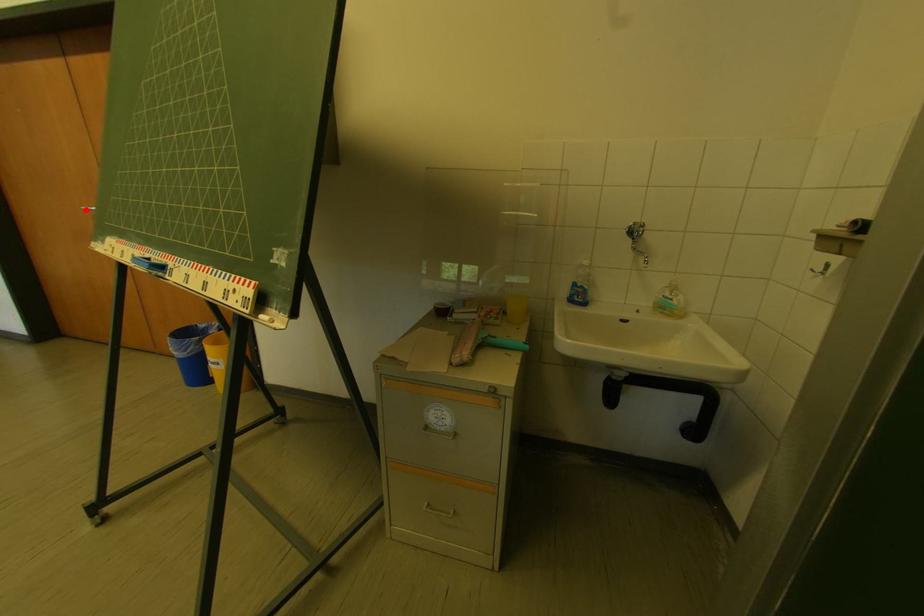
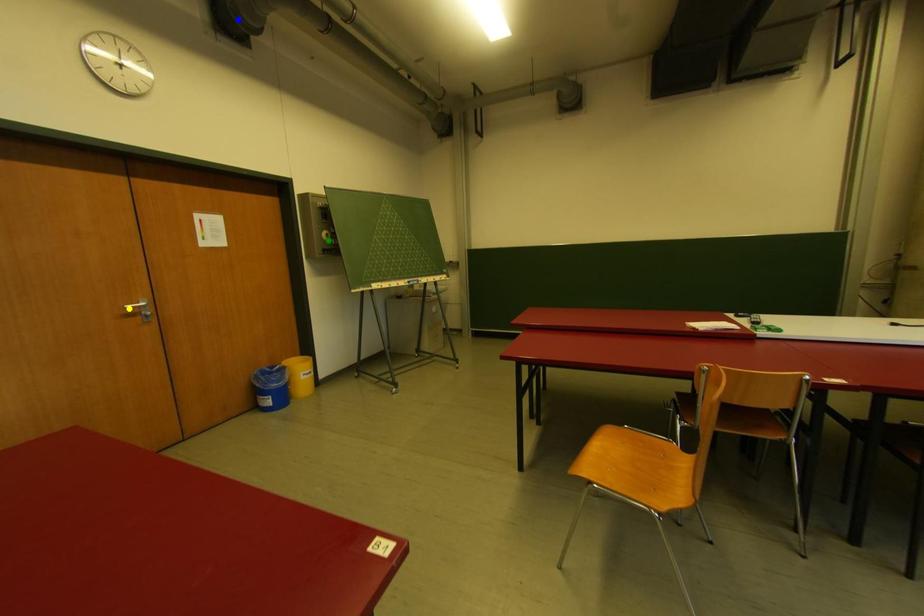
Question: I am providing you with two images of the same scene from different viewpoints. A red point is marked on the first image. You are given multiple points on the second image. In image 2, which mark is for the same physical point as the one in image 1?

Choices:
 (A) yellow point
 (B) green point
 (C) blue point

Answer: (A)